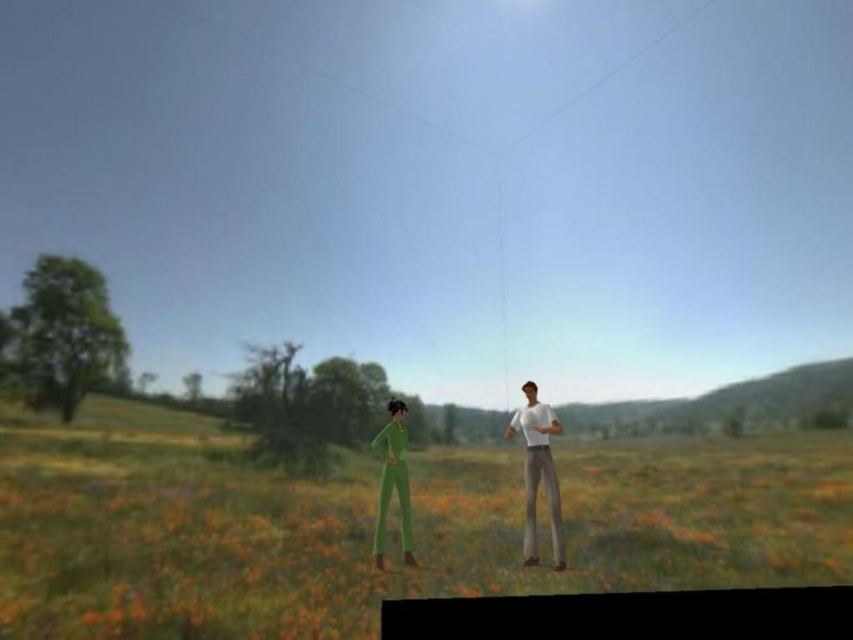
Between point (61, 531) and point (558, 497), which one is positioned in front?

Point (558, 497) is more forward.

Can you confirm if green grassy field at center is smaller than white matte pants at right?

No, green grassy field at center is not smaller than white matte pants at right.

Find the location of a particular element. green grassy field at center is located at coordinates (370, 525).

Looking at this image, is green grassy field at center positioned before green matte jumpsuit at lower left?

Yes.

Can you confirm if green grassy field at center is bigger than green matte jumpsuit at lower left?

Indeed, green grassy field at center has a larger size compared to green matte jumpsuit at lower left.

This screenshot has height=640, width=853. Describe the element at coordinates (370, 525) in the screenshot. I see `green grassy field at center` at that location.

The width and height of the screenshot is (853, 640). In order to click on green grassy field at center in this screenshot , I will do `click(370, 525)`.

Who is more forward, (547,416) or (407,525)?

Point (547,416) is in front.

Who is more forward, (532, 452) or (381, 440)?

Point (532, 452)

Identify the location of white matte pants at right. (538, 472).